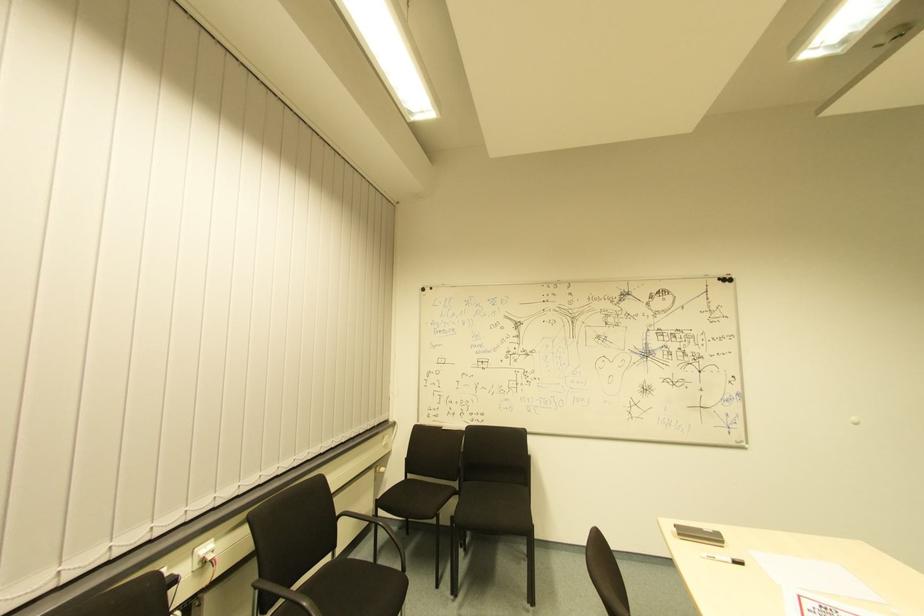
Find the location of a particular element. black chair armrest is located at coordinates (377, 532).